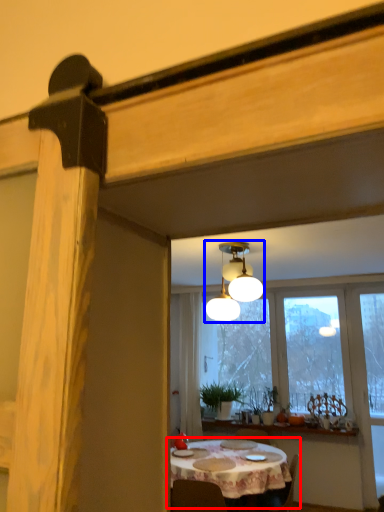
Question: Which of the following is the closest to the observer, kitchen & dining room table (highlighted by a red box) or lamp (highlighted by a blue box)?

Choices:
 (A) kitchen & dining room table
 (B) lamp

Answer: (B)